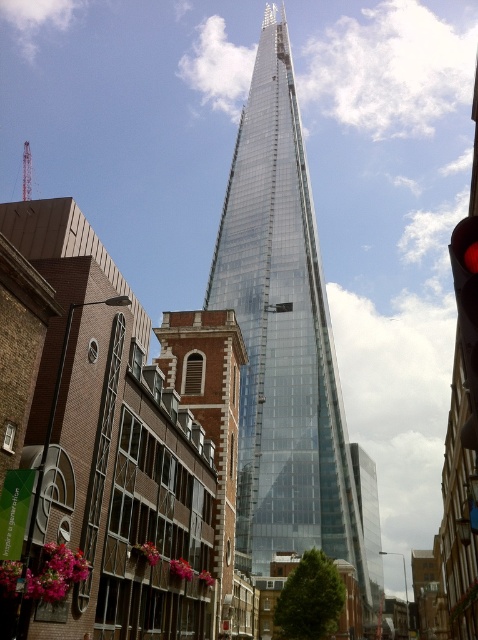
You are a pedestrian standing at the intersection and want to cross the street. You see the transparent glass tower at center and the red glass traffic light at right. Which object is located to the left of the other?

The transparent glass tower at center is positioned on the left side of red glass traffic light at right.

You are a city planner analyzing the urban layout. Given the transparent glass tower at center and the red glass traffic light at right, which object occupies a larger horizontal space in the image?

The transparent glass tower at center is wider than the red glass traffic light at right, so it occupies a larger horizontal space.